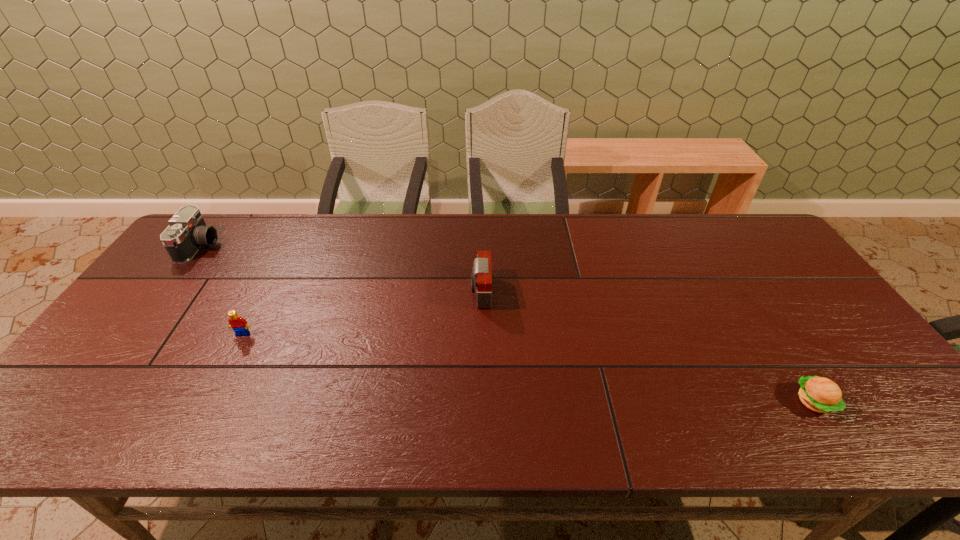
Locate an element on the screen. vacant space that satisfies the following two spatial constraints: 1. on the front-facing side of the shortest object; 2. on the left side of the leftmost object is located at coordinates (82, 402).

At what (x,y) coordinates should I click in order to perform the action: click on vacant space that satisfies the following two spatial constraints: 1. on the front-facing side of the second nearest object; 2. on the left side of the nearest object. Please return your answer as a coordinate pair (x, y). This screenshot has width=960, height=540. Looking at the image, I should click on (207, 402).

Image resolution: width=960 pixels, height=540 pixels. Identify the location of vacant area in the image that satisfies the following two spatial constraints: 1. on the front-facing side of the rightmost object; 2. on the right side of the Lego. (207, 402).

I want to click on free location that satisfies the following two spatial constraints: 1. on the back side of the hamburger; 2. on the front-facing side of the farthest object, so click(x=714, y=246).

Identify the location of vacant space that satisfies the following two spatial constraints: 1. on the front-facing side of the third farthest object; 2. on the right side of the hamburger. This screenshot has height=540, width=960. (207, 402).

Locate an element on the screen. The height and width of the screenshot is (540, 960). vacant space that satisfies the following two spatial constraints: 1. on the front-facing side of the nearer camera; 2. on the back side of the nearest object is located at coordinates (481, 402).

I want to click on free spot that satisfies the following two spatial constraints: 1. on the front-facing side of the rightmost object; 2. on the left side of the farthest object, so click(82, 402).

The height and width of the screenshot is (540, 960). What are the coordinates of `vacant space that satisfies the following two spatial constraints: 1. on the front-facing side of the leftmost object; 2. on the right side of the shortest object` in the screenshot? It's located at (82, 402).